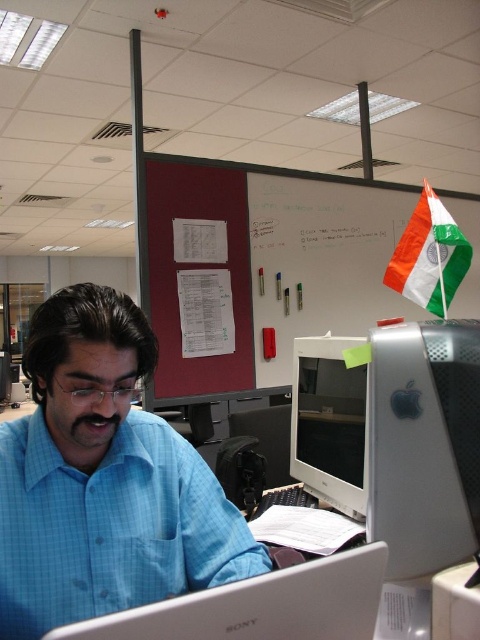
Question: Does blue checkered shirt at center come behind white fabric flag at upper right?

Choices:
 (A) yes
 (B) no

Answer: (B)

Question: Does maroon fabric bulletin board at upper center have a greater width compared to matte blue laptop at lower center?

Choices:
 (A) yes
 (B) no

Answer: (A)

Question: Considering the real-world distances, which object is farthest from the matte silver monitor at center?

Choices:
 (A) satin silver monitor at right
 (B) white fabric flag at upper right

Answer: (B)

Question: Which point is farther to the camera?

Choices:
 (A) (291, 280)
 (B) (331, 452)

Answer: (A)

Question: Does blue checkered shirt at center have a larger size compared to matte blue laptop at lower center?

Choices:
 (A) yes
 (B) no

Answer: (A)

Question: Which is nearer to the white fabric flag at upper right?

Choices:
 (A) satin silver monitor at right
 (B) maroon fabric bulletin board at upper center

Answer: (A)